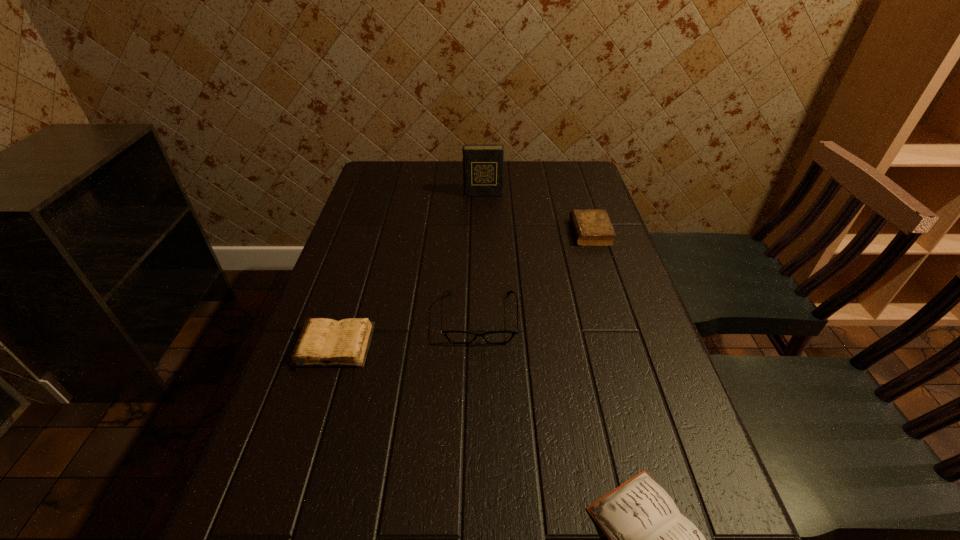
At what (x,y) coordinates should I click in order to perform the action: click on the tallest object. Please return your answer as a coordinate pair (x, y). Looking at the image, I should click on (482, 164).

Locate an element on the screen. The height and width of the screenshot is (540, 960). the farthest diary is located at coordinates (482, 164).

Find the location of a particular element. the fourth shortest object is located at coordinates (461, 337).

At what (x,y) coordinates should I click in order to perform the action: click on the third shortest object. Please return your answer as a coordinate pair (x, y). Looking at the image, I should click on click(x=592, y=227).

Locate an element on the screen. The width and height of the screenshot is (960, 540). the second farthest object is located at coordinates (592, 227).

Identify the location of the leftmost diary. (324, 342).

Locate an element on the screen. the second shortest diary is located at coordinates (324, 342).

This screenshot has height=540, width=960. I want to click on blank space located on the front cover of the farthest object, so click(484, 265).

Find the location of a particular element. This screenshot has height=540, width=960. vacant area located on the front-facing side of the second tallest object is located at coordinates tap(479, 509).

In order to click on vacant space located on the spine side of the third nearest diary in this screenshot , I will do `click(459, 232)`.